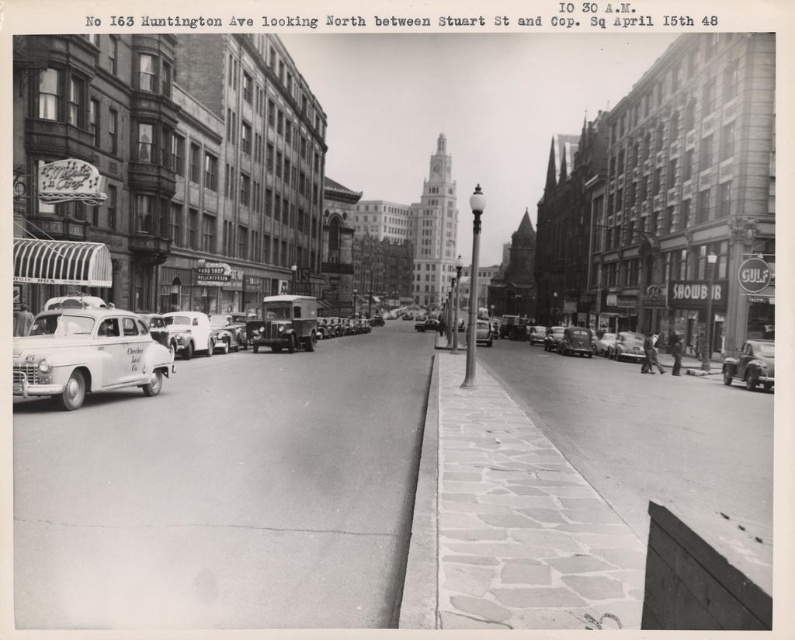
Question: Is white matte taxi at left to the right of shiny silver car at right from the viewer's perspective?

Choices:
 (A) no
 (B) yes

Answer: (A)

Question: Which of the following is the closest to the observer?

Choices:
 (A) shiny silver car at right
 (B) white matte taxi at left
 (C) white matte van at center-left

Answer: (B)

Question: Is shiny silver car at right to the right of white matte van at center-left from the viewer's perspective?

Choices:
 (A) yes
 (B) no

Answer: (A)

Question: Can you confirm if shiny silver car at right is bigger than white matte van at center-left?

Choices:
 (A) no
 (B) yes

Answer: (B)

Question: Among these points, which one is nearest to the camera?

Choices:
 (A) pyautogui.click(x=126, y=369)
 (B) pyautogui.click(x=757, y=358)
 (C) pyautogui.click(x=173, y=332)

Answer: (A)

Question: Estimate the real-world distances between objects in this image. Which object is closer to the shiny silver car at right?

Choices:
 (A) white matte taxi at left
 (B) white matte van at center-left

Answer: (A)